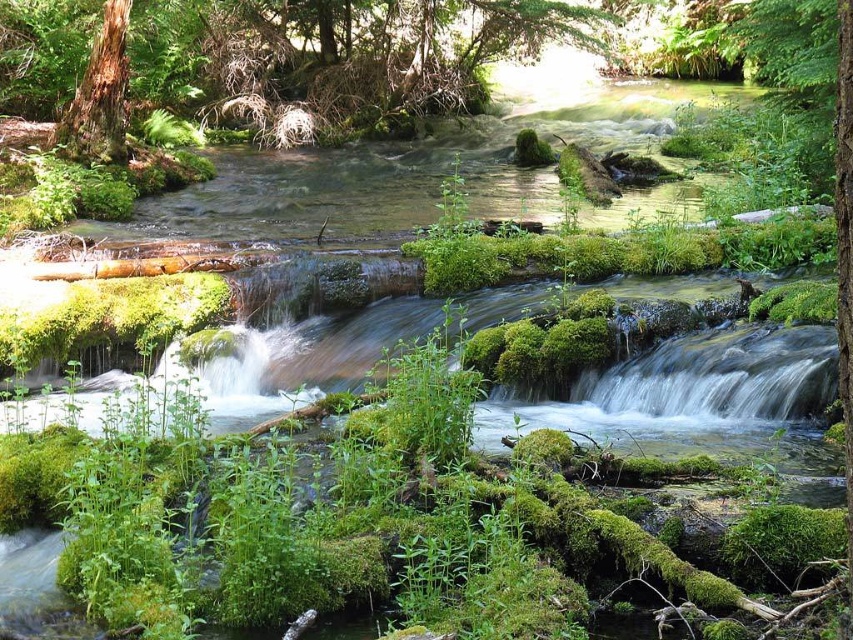
Question: Which of the following is the farthest from the observer?

Choices:
 (A) brown textured tree trunk at upper left
 (B) smooth brown tree trunk at upper left

Answer: (B)

Question: Can you confirm if smooth brown tree trunk at upper left is positioned below brown textured tree trunk at upper left?

Choices:
 (A) no
 (B) yes

Answer: (A)

Question: Can you confirm if smooth brown tree trunk at upper left is positioned to the right of brown textured tree trunk at upper left?

Choices:
 (A) no
 (B) yes

Answer: (B)

Question: Is smooth brown tree trunk at upper left to the left of brown textured tree trunk at upper left from the viewer's perspective?

Choices:
 (A) no
 (B) yes

Answer: (A)